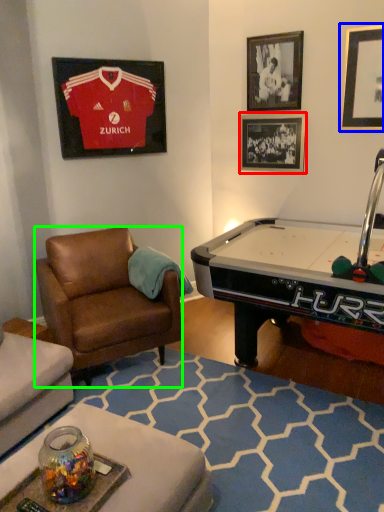
Question: Considering the real-world distances, which object is farthest from picture frame (highlighted by a red box)? picture frame (highlighted by a blue box) or chair (highlighted by a green box)?

Choices:
 (A) picture frame
 (B) chair

Answer: (B)